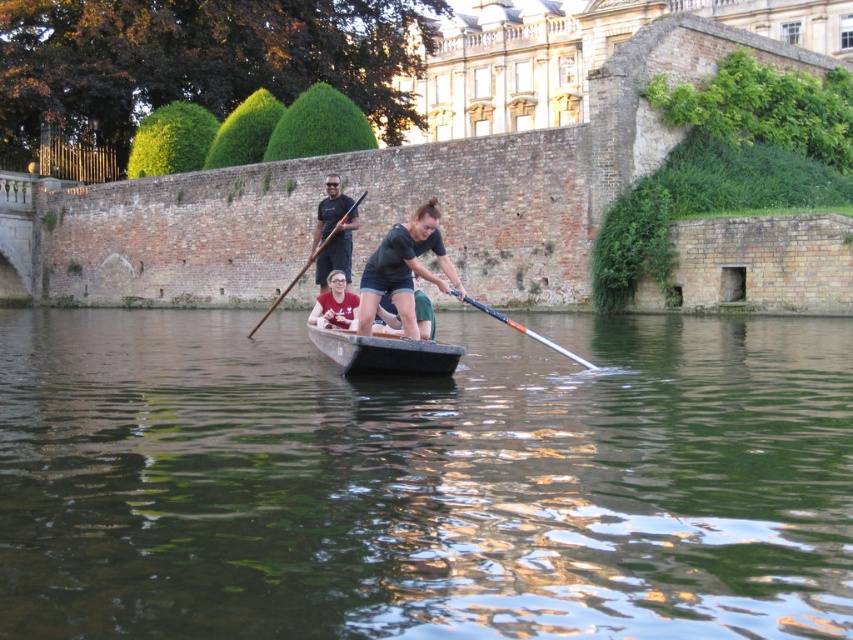
Question: Is green smooth water at center bigger than black plastic canoe at center?

Choices:
 (A) yes
 (B) no

Answer: (A)

Question: Which point is farther to the camera?

Choices:
 (A) matte black paddle at upper center
 (B) dark blue fabric shirt at center
 (C) wooden paddle at center

Answer: (C)

Question: Which point is closer to the camera?

Choices:
 (A) blue metallic paddle at center
 (B) black plastic canoe at center
 (C) matte black paddle at upper center
 (D) dark blue fabric shirt at center

Answer: (B)

Question: Which point appears farthest from the camera in this image?

Choices:
 (A) (403, 234)
 (B) (317, 298)
 (C) (445, 374)
 (D) (279, 298)

Answer: (D)

Question: Does black plastic canoe at center appear under matte red shirt at center?

Choices:
 (A) yes
 (B) no

Answer: (A)

Question: Is matte red shirt at center thinner than wooden paddle at center?

Choices:
 (A) yes
 (B) no

Answer: (A)